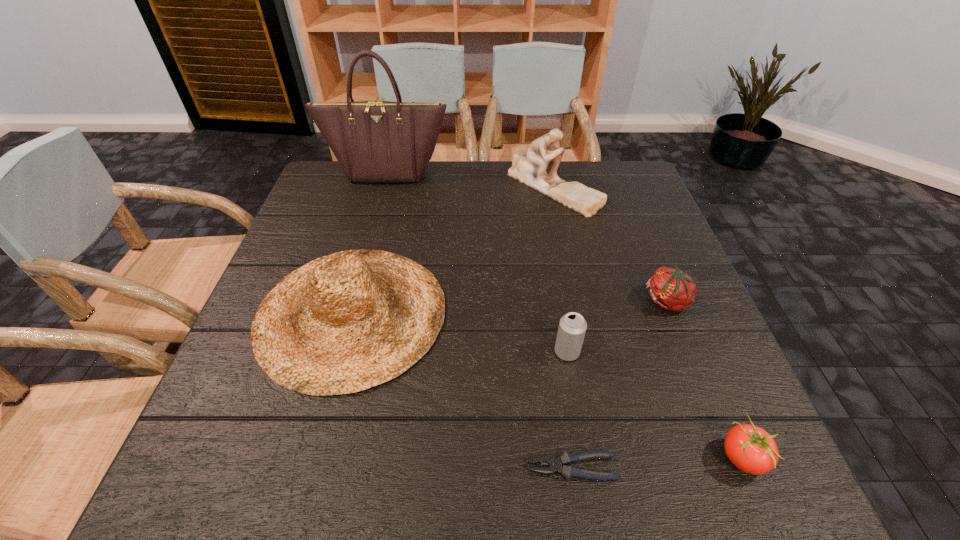
Locate an element on the screen. vacant space located on the right of the beer can is located at coordinates (660, 352).

Locate an element on the screen. This screenshot has height=540, width=960. free region located on the back of the farther tomato is located at coordinates (631, 209).

This screenshot has width=960, height=540. I want to click on vacant area situated on the back of the nearer tomato, so click(671, 290).

At what (x,y) coordinates should I click in order to perform the action: click on vacant position located 0.110m at the gripping part of the pliers. Please return your answer as a coordinate pair (x, y). Looking at the image, I should click on pos(460,468).

Locate an element on the screen. The height and width of the screenshot is (540, 960). vacant space situated at the gripping part of the pliers is located at coordinates (356, 468).

Find the location of a particular element. This screenshot has width=960, height=540. free space located 0.070m at the gripping part of the pliers is located at coordinates (484, 468).

This screenshot has width=960, height=540. I want to click on handbag that is at the far edge, so click(x=374, y=141).

Image resolution: width=960 pixels, height=540 pixels. In order to click on figurine present at the far edge in this screenshot , I will do `click(529, 167)`.

At what (x,y) coordinates should I click in order to perform the action: click on tomato situated at the near edge. Please return your answer as a coordinate pair (x, y). The width and height of the screenshot is (960, 540). Looking at the image, I should click on (751, 449).

You are a GUI agent. You are given a task and a screenshot of the screen. Output one action in this format:
    pyautogui.click(x=<x>, y=<y>)
    Task: Click on the pliers present at the near edge
    
    Given the screenshot: What is the action you would take?
    pyautogui.click(x=568, y=472)